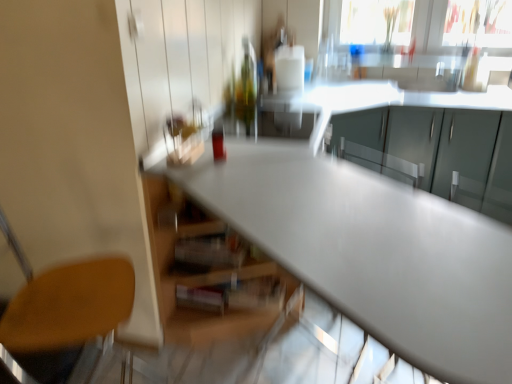
Question: Should I look upward or downward to see transparent glass window screen at upper right?

Choices:
 (A) down
 (B) up

Answer: (B)

Question: Is the position of matte gray cabinets at upper right more distant than that of satin white table at center?

Choices:
 (A) no
 (B) yes

Answer: (B)

Question: Is matte gray cabinets at upper right aimed at satin white table at center?

Choices:
 (A) no
 (B) yes

Answer: (B)

Question: Would you consider matte gray cabinets at upper right to be distant from satin white table at center?

Choices:
 (A) no
 (B) yes

Answer: (A)

Question: From the image's perspective, would you say matte gray cabinets at upper right is positioned over satin white table at center?

Choices:
 (A) no
 (B) yes

Answer: (B)

Question: From a real-world perspective, does matte gray cabinets at upper right stand above satin white table at center?

Choices:
 (A) no
 (B) yes

Answer: (A)

Question: Is satin white table at center at the back of matte gray cabinets at upper right?

Choices:
 (A) no
 (B) yes

Answer: (A)

Question: Does transparent glass window screen at upper right contain wooden seat at lower left?

Choices:
 (A) no
 (B) yes

Answer: (A)

Question: Is the position of transparent glass window screen at upper right more distant than that of wooden seat at lower left?

Choices:
 (A) no
 (B) yes

Answer: (B)

Question: Can you confirm if transparent glass window screen at upper right is taller than wooden seat at lower left?

Choices:
 (A) yes
 (B) no

Answer: (B)

Question: Does transparent glass window screen at upper right have a greater width compared to wooden seat at lower left?

Choices:
 (A) no
 (B) yes

Answer: (A)

Question: Is transparent glass window screen at upper right looking in the opposite direction of wooden seat at lower left?

Choices:
 (A) yes
 (B) no

Answer: (B)

Question: Are transparent glass window screen at upper right and wooden seat at lower left far apart?

Choices:
 (A) no
 (B) yes

Answer: (B)

Question: Is transparent glass window screen at upper right looking in the opposite direction of satin white table at center?

Choices:
 (A) no
 (B) yes

Answer: (A)